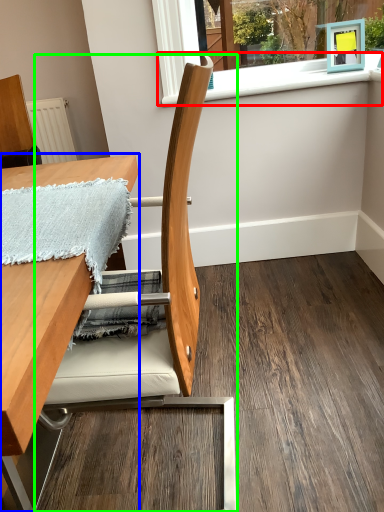
Question: Which object is positioned farthest from window sill (highlighted by a red box)? Select from table (highlighted by a blue box) and chair (highlighted by a green box).

Choices:
 (A) table
 (B) chair

Answer: (B)